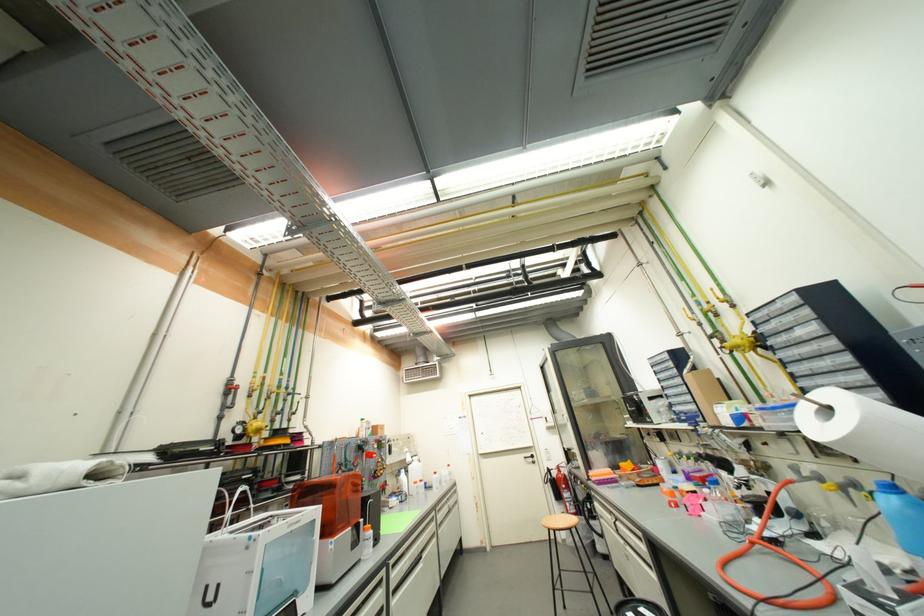
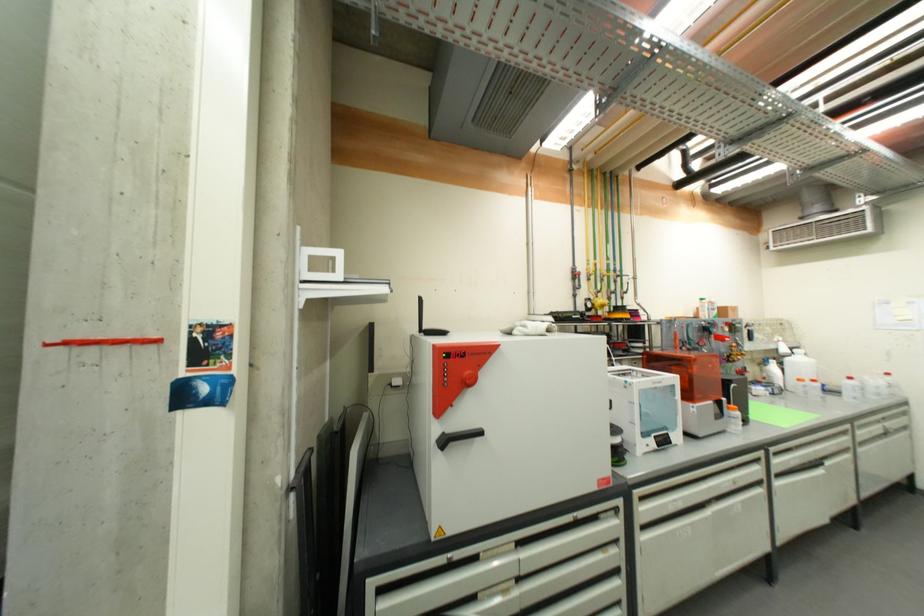
In the second image, find the point that corresponds to the point at 373,532 in the first image.

(739, 411)